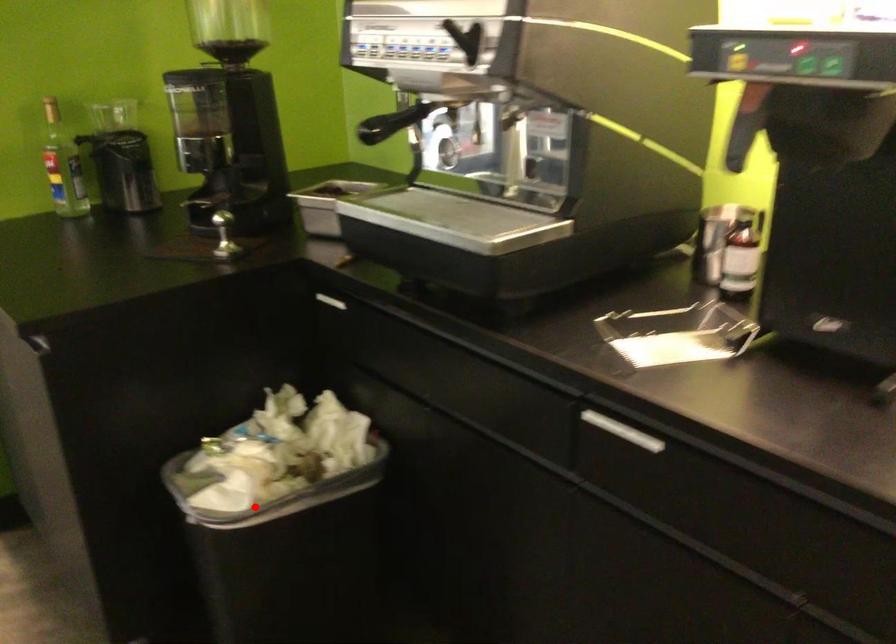
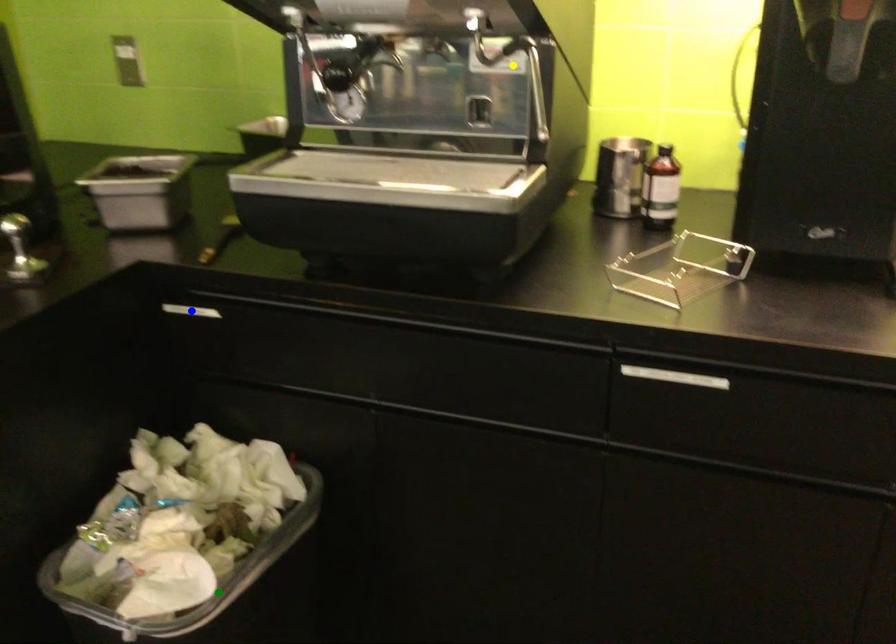
Question: I am providing you with two images of the same scene from different viewpoints. A red point is marked on the first image. You are given multiple points on the second image. Which spot in image 2 lines up with the point in image 1?

Choices:
 (A) blue point
 (B) green point
 (C) yellow point

Answer: (B)